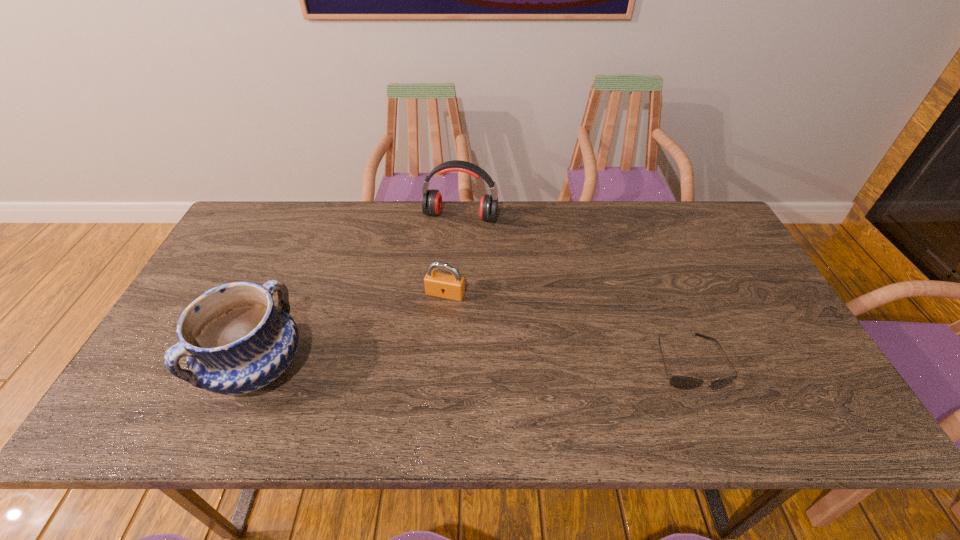
I want to click on the leftmost object, so click(x=236, y=341).

You are a GUI agent. You are given a task and a screenshot of the screen. Output one action in this format:
    pyautogui.click(x=<x>, y=<y>)
    Task: Click on the sunglasses
    
    Given the screenshot: What is the action you would take?
    pyautogui.click(x=681, y=382)

Locate an element on the screen. The image size is (960, 540). the rightmost object is located at coordinates (681, 382).

What are the coordinates of `padlock` in the screenshot? It's located at (441, 285).

Where is `the third tallest object`? Image resolution: width=960 pixels, height=540 pixels. the third tallest object is located at coordinates (441, 285).

Where is `earphone`? The width and height of the screenshot is (960, 540). earphone is located at coordinates [432, 199].

Identify the location of free spot located 0.260m on the back of the pottery. click(x=302, y=259).

Find the location of a particular element. The image size is (960, 540). free space located 0.200m to unlock the padlock from the front is located at coordinates (415, 362).

The width and height of the screenshot is (960, 540). I want to click on free region located to unlock the padlock from the front, so click(416, 359).

Find the location of a particular element. This screenshot has height=540, width=960. vacant space located 0.200m to unlock the padlock from the front is located at coordinates (415, 362).